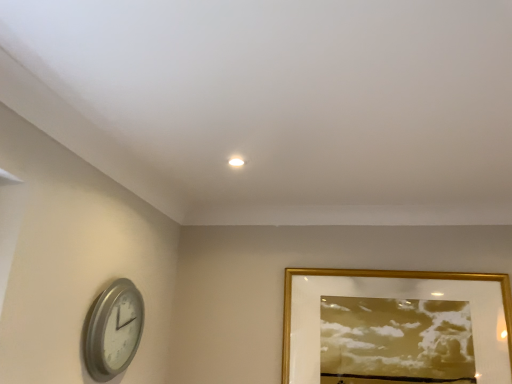
Question: Does silver metallic clock at lower left come in front of gold metallic picture frame at upper right?

Choices:
 (A) yes
 (B) no

Answer: (A)

Question: Can you confirm if silver metallic clock at lower left is shorter than gold metallic picture frame at upper right?

Choices:
 (A) yes
 (B) no

Answer: (A)

Question: Can you confirm if silver metallic clock at lower left is smaller than gold metallic picture frame at upper right?

Choices:
 (A) no
 (B) yes

Answer: (B)

Question: Is gold metallic picture frame at upper right located within silver metallic clock at lower left?

Choices:
 (A) no
 (B) yes

Answer: (A)

Question: From a real-world perspective, does silver metallic clock at lower left stand above gold metallic picture frame at upper right?

Choices:
 (A) no
 (B) yes

Answer: (A)

Question: From the image's perspective, is silver metallic clock at lower left located beneath gold metallic picture frame at upper right?

Choices:
 (A) yes
 (B) no

Answer: (B)

Question: Does gold metallic picture frame at upper right have a lesser width compared to silver metallic clock at lower left?

Choices:
 (A) yes
 (B) no

Answer: (A)

Question: Considering the relative sizes of gold metallic picture frame at upper right and silver metallic clock at lower left in the image provided, is gold metallic picture frame at upper right bigger than silver metallic clock at lower left?

Choices:
 (A) no
 (B) yes

Answer: (B)

Question: Does gold metallic picture frame at upper right have a smaller size compared to silver metallic clock at lower left?

Choices:
 (A) yes
 (B) no

Answer: (B)

Question: From a real-world perspective, does gold metallic picture frame at upper right stand above silver metallic clock at lower left?

Choices:
 (A) no
 (B) yes

Answer: (B)

Question: Is gold metallic picture frame at upper right not within silver metallic clock at lower left?

Choices:
 (A) yes
 (B) no

Answer: (A)

Question: Is gold metallic picture frame at upper right at the right side of silver metallic clock at lower left?

Choices:
 (A) no
 (B) yes

Answer: (B)

Question: Looking at the image, does silver metallic clock at lower left seem bigger or smaller compared to gold metallic picture frame at upper right?

Choices:
 (A) small
 (B) big

Answer: (A)